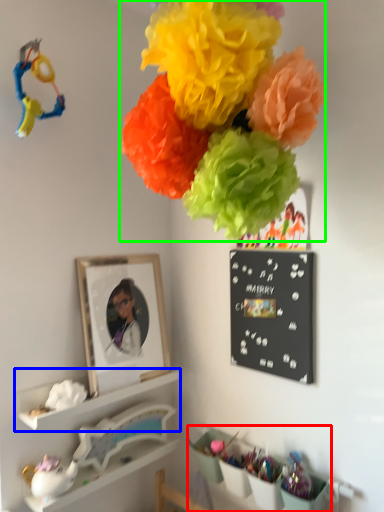
Question: Which is nearer to the shelf (highlighted by a red box)? shelf (highlighted by a blue box) or flower (highlighted by a green box).

Choices:
 (A) shelf
 (B) flower

Answer: (A)